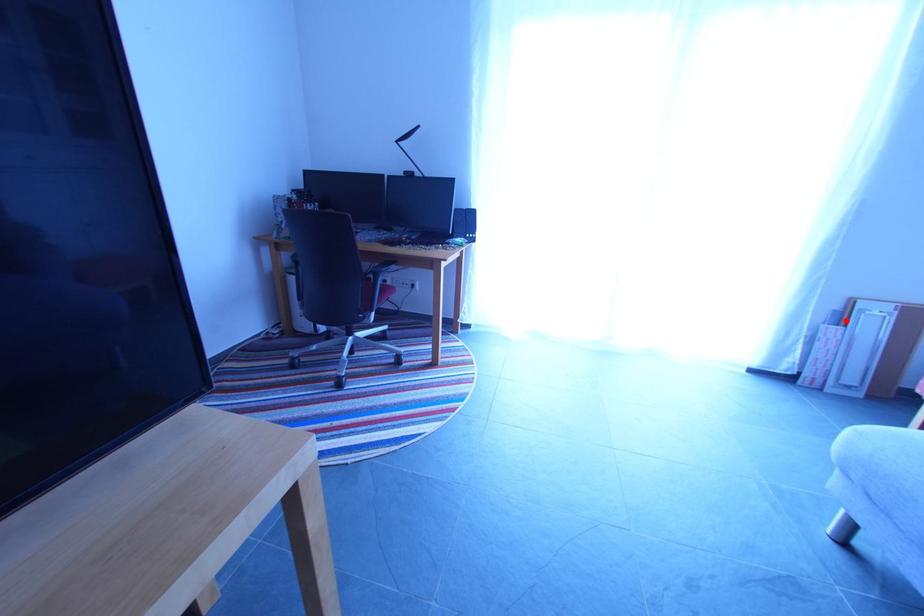
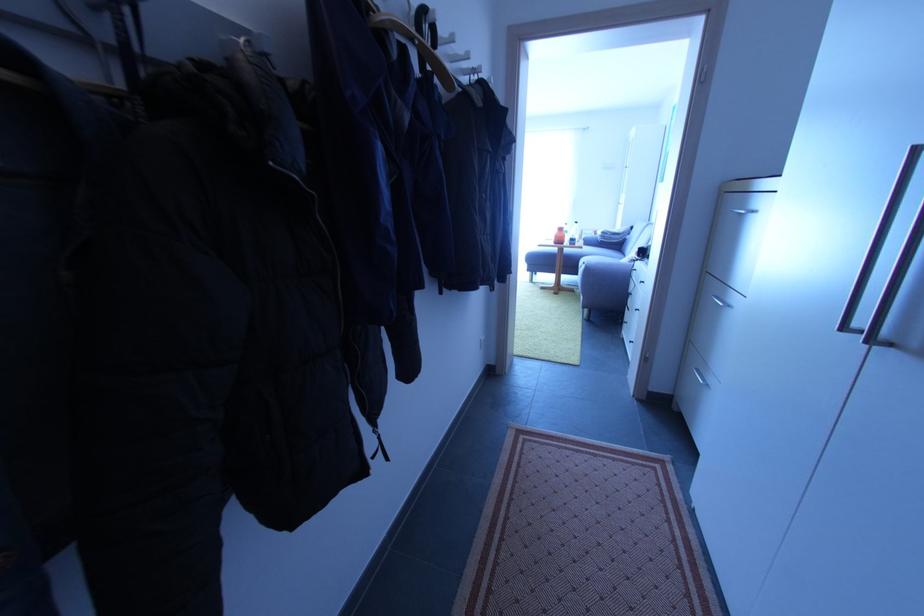
Locate, in the second image, the point that corresponds to the highlighted location in the first image.

(585, 238)